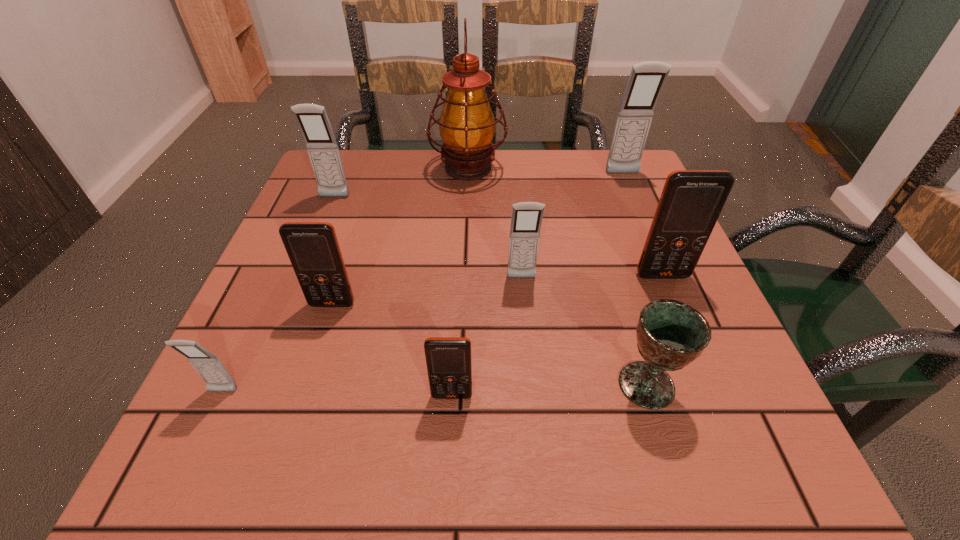
Locate an element on the screen. The image size is (960, 540). vacant space at the left edge of the desktop is located at coordinates (291, 342).

This screenshot has width=960, height=540. In order to click on free spot at the right edge of the desktop in this screenshot , I will do point(637,261).

Where is `free space at the far left corner`? This screenshot has height=540, width=960. free space at the far left corner is located at coordinates (352, 180).

This screenshot has height=540, width=960. Identify the location of free spot at the near right corner of the desktop. (726, 431).

At what (x,y) coordinates should I click in order to perform the action: click on free spot between the rightmost orange cellular telephone and the sixth farthest object. Please return your answer as a coordinate pair (x, y). Image resolution: width=960 pixels, height=540 pixels. Looking at the image, I should click on (497, 289).

I want to click on free point between the nearest orange cellular telephone and the leftmost orange cellular telephone, so click(393, 349).

In order to click on free space between the farthest orange cellular telephone and the tallest object in this screenshot , I will do `click(565, 222)`.

Where is `empty space that is in between the second farthest gray cellular telephone and the nearest gray cellular telephone`? This screenshot has width=960, height=540. empty space that is in between the second farthest gray cellular telephone and the nearest gray cellular telephone is located at coordinates (278, 294).

Identify the location of free area in between the biggest gray cellular telephone and the second farthest orange cellular telephone. Image resolution: width=960 pixels, height=540 pixels. (477, 239).

Image resolution: width=960 pixels, height=540 pixels. What are the coordinates of `vacant space in between the farthest orange cellular telephone and the third gray cellular telephone from left to right` in the screenshot? It's located at (592, 277).